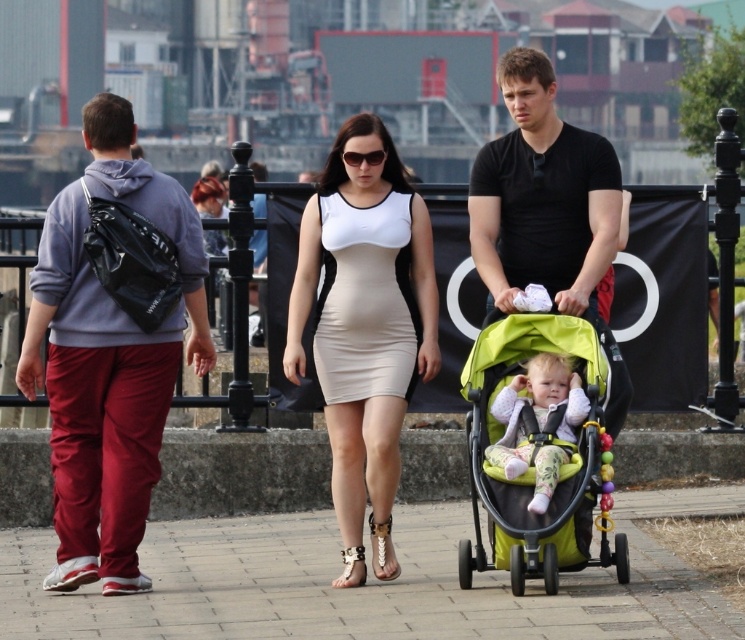
Question: Can you confirm if matte white dress at center is positioned above fluffy pink jacket at center?

Choices:
 (A) no
 (B) yes

Answer: (B)

Question: Which is farther from the fluffy pink jacket at center?

Choices:
 (A) paved stone pavement at center
 (B) beige matte dress at center
 (C) matte gray hoodie at left

Answer: (C)

Question: Is green fabric stroller at center wider than beige matte dress at center?

Choices:
 (A) yes
 (B) no

Answer: (A)

Question: Which point is closer to the camera taking this photo?

Choices:
 (A) (270, 634)
 (B) (348, 316)
 (C) (112, 339)

Answer: (A)

Question: Does matte white dress at center have a larger size compared to matte gray hoodie at left?

Choices:
 (A) yes
 (B) no

Answer: (B)

Question: Which point appears farthest from the camera in this image?

Choices:
 (A) (329, 298)
 (B) (413, 317)

Answer: (B)